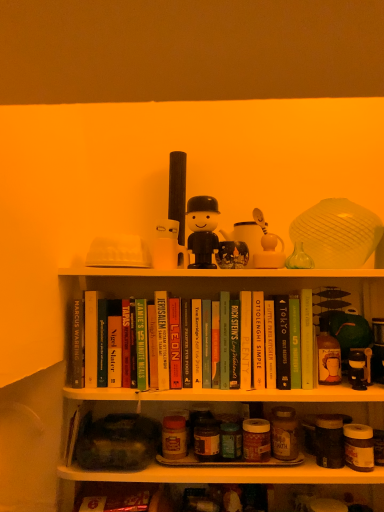
In order to click on vacant area that lies in front of hardcover book at center, which appears as the 3th paperback book when viewed from the right in this screenshot , I will do `click(297, 389)`.